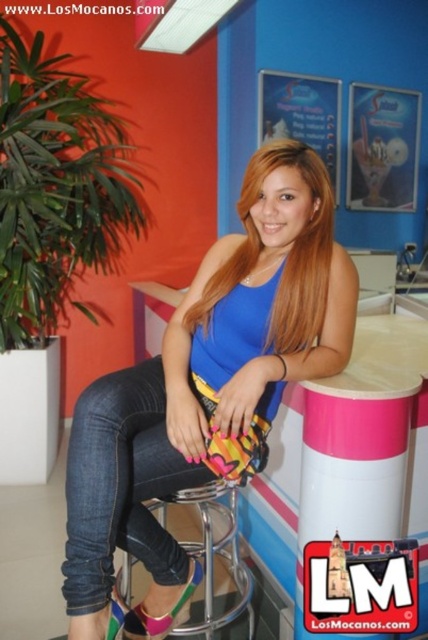
You are designing a virtual reality game where players must identify objects based on their size. In this scene, you see the blue matte tank top at center and the metallic silver bar stool at center. Which object is taller?

The blue matte tank top at center is taller than the metallic silver bar stool at center.

You are standing in front of the bar counter and want to reach the point marked at coordinates point (305, 225). Considering your height is 5.5 feet, will you be able to comfortably reach that point without stretching?

The distance between you and point (305, 225) is 4.34 feet. Since the average comfortable reaching distance for someone 5.5 feet tall is about 2.5 feet, you would need to stretch or move closer to comfortably reach it.